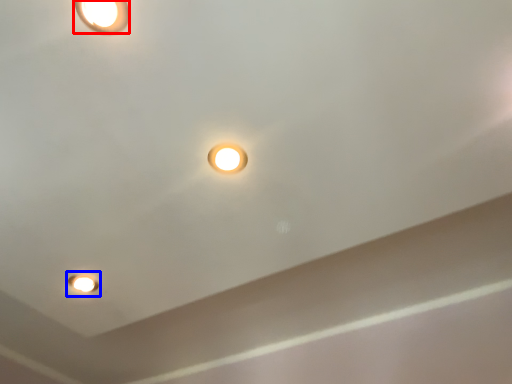
Question: Which object appears farthest to the camera in this image, lamp (highlighted by a red box) or light fixture (highlighted by a blue box)?

Choices:
 (A) lamp
 (B) light fixture

Answer: (B)